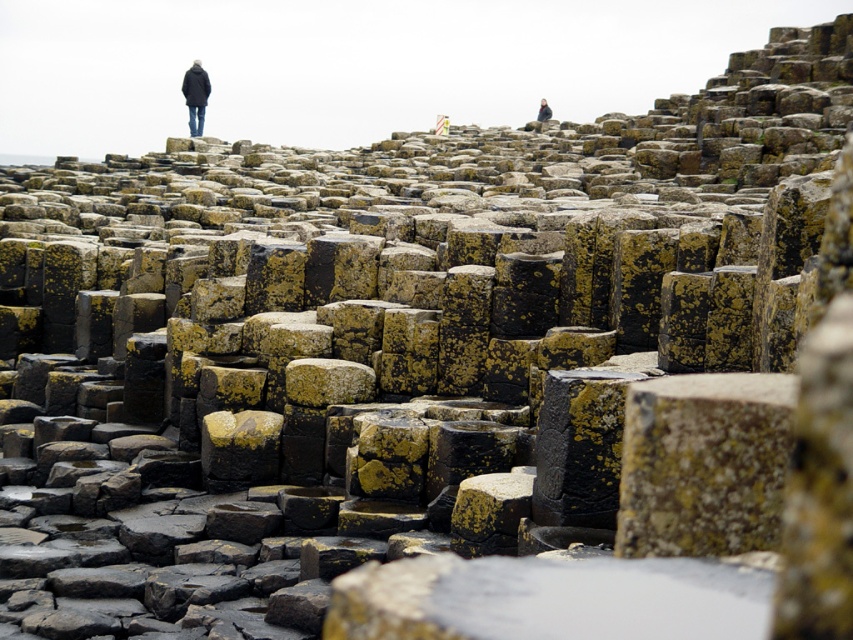
Can you confirm if black matte coat at upper left is wider than dark gray jacket at upper center?

No.

Which is behind, point (195, 74) or point (546, 109)?

Positioned behind is point (546, 109).

Is point (189, 118) positioned behind point (544, 106)?

No, it is in front of (544, 106).

Where is `black matte coat at upper left`? black matte coat at upper left is located at coordinates (195, 97).